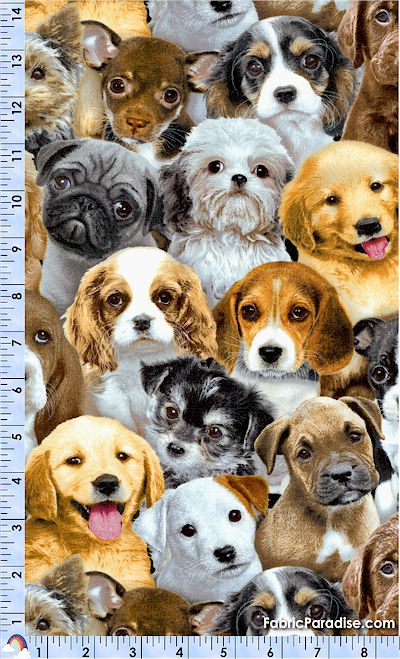
The width and height of the screenshot is (400, 659). I want to click on fabric swatch, so click(x=197, y=279).